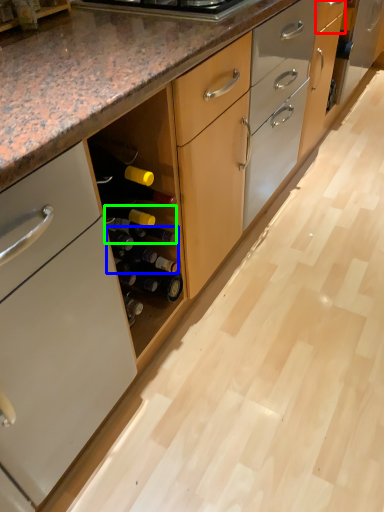
Question: Which object is the closest to the drawer (highlighted by a red box)? Choose among these: beer bottle (highlighted by a blue box) or wine bottle (highlighted by a green box).

Choices:
 (A) beer bottle
 (B) wine bottle

Answer: (B)